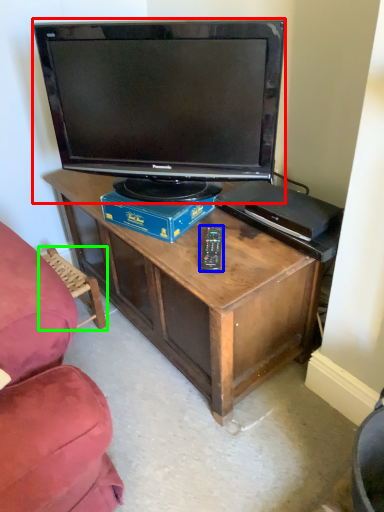
Question: Considering the real-world distances, which object is closest to television (highlighted by a red box)? remote (highlighted by a blue box) or swivel chair (highlighted by a green box).

Choices:
 (A) remote
 (B) swivel chair

Answer: (A)